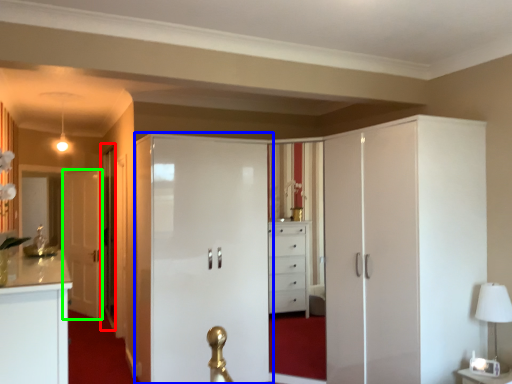
Question: Estimate the real-world distances between objects in this image. Which object is farther from glass door (highlighted by a red box), door (highlighted by a blue box) or door (highlighted by a green box)?

Choices:
 (A) door
 (B) door

Answer: (A)